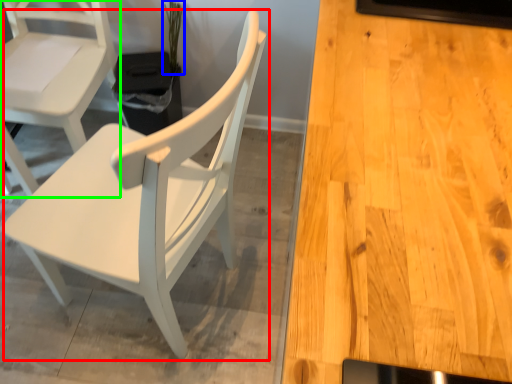
Question: Based on their relative distances, which object is nearer to chair (highlighted by a red box)? Choose from plant (highlighted by a blue box) and chair (highlighted by a green box).

Choices:
 (A) plant
 (B) chair

Answer: (B)